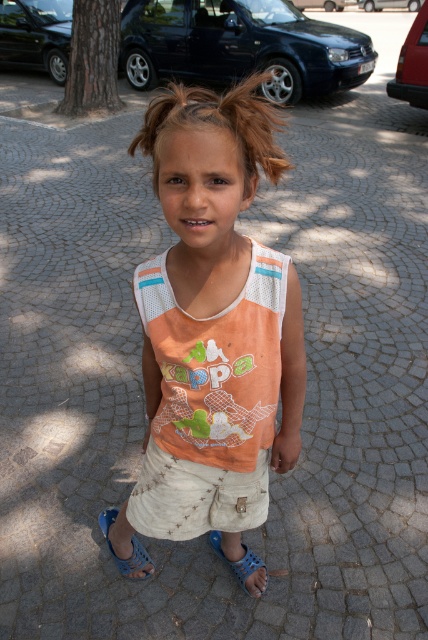
Can you confirm if white cotton shorts at center is positioned to the left of blue rubber sandal at lower left?

Incorrect, white cotton shorts at center is not on the left side of blue rubber sandal at lower left.

Is white cotton shorts at center taller than blue rubber sandal at lower left?

Yes, white cotton shorts at center is taller than blue rubber sandal at lower left.

The width and height of the screenshot is (428, 640). Identify the location of white cotton shorts at center. (196, 497).

Is light brown textured hair at center wider than blue rubber sandal at lower left?

Yes.

At what (x,y) coordinates should I click in order to perform the action: click on light brown textured hair at center. Please return your answer as a coordinate pair (x, y). This screenshot has height=640, width=428. Looking at the image, I should click on (217, 124).

The image size is (428, 640). I want to click on light brown textured hair at center, so click(217, 124).

Locate an element on the screen. The width and height of the screenshot is (428, 640). light brown textured hair at center is located at coordinates (217, 124).

From the picture: Does orange mesh tank top at center have a greater width compared to light brown textured hair at center?

Yes, orange mesh tank top at center is wider than light brown textured hair at center.

Is orange mesh tank top at center above light brown textured hair at center?

No, orange mesh tank top at center is not above light brown textured hair at center.

Between point (219, 404) and point (234, 106), which one is positioned in front?

Positioned in front is point (234, 106).

This screenshot has height=640, width=428. Find the location of `orange mesh tank top at center`. orange mesh tank top at center is located at coordinates (214, 317).